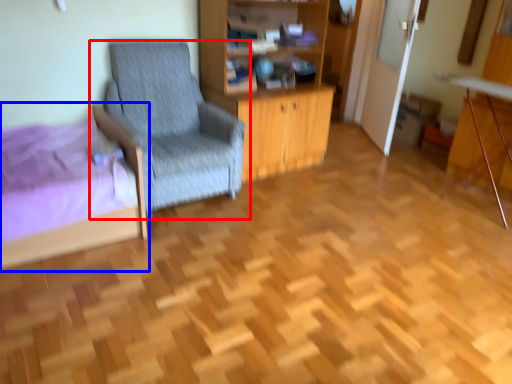
Question: Which point is further to the camera, chair (highlighted by a red box) or bed (highlighted by a blue box)?

Choices:
 (A) chair
 (B) bed

Answer: (A)